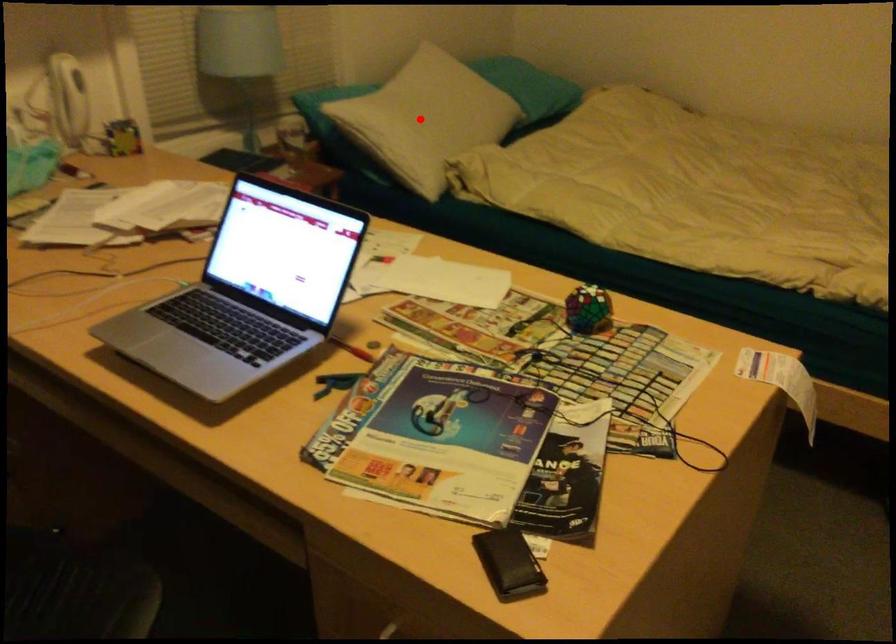
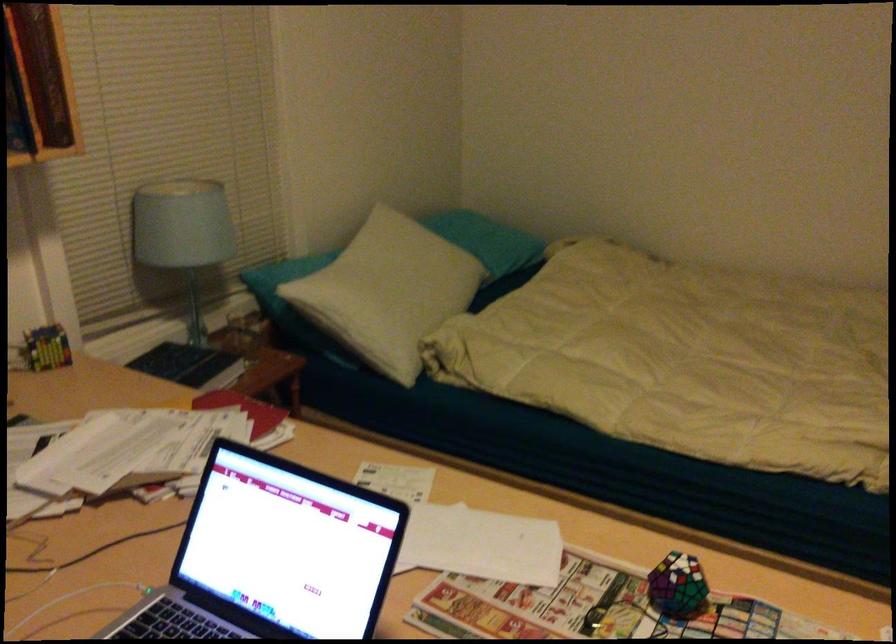
The point at the highlighted location is marked in the first image. Where is the corresponding point in the second image?

(389, 292)